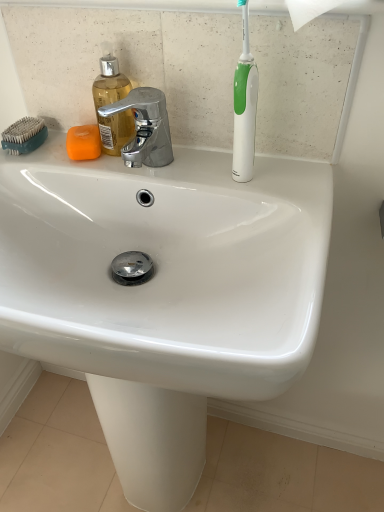
Identify the location of free space on the front side of orange matte soap at upper left. The height and width of the screenshot is (512, 384). (92, 167).